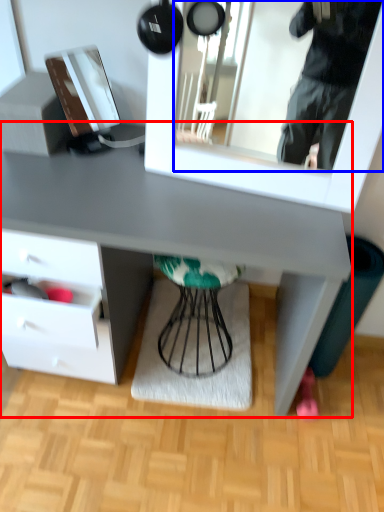
Question: Which object is further to the camera taking this photo, desk (highlighted by a red box) or mirror (highlighted by a blue box)?

Choices:
 (A) desk
 (B) mirror

Answer: (A)